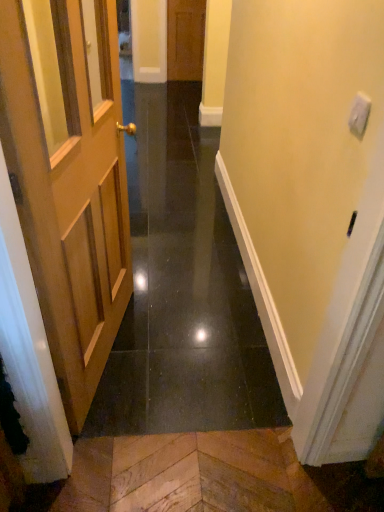
Question: Is wooden door at center, the second door positioned from the bottom, oriented away from light brown wooden door at left, the second door from the top?

Choices:
 (A) yes
 (B) no

Answer: (B)

Question: From the image's perspective, does wooden door at center, placed as the 1th door when sorted from back to front, appear lower than light brown wooden door at left, acting as the 1th door starting from the bottom?

Choices:
 (A) no
 (B) yes

Answer: (A)

Question: Is the depth of wooden door at center, the 2th door when ordered from front to back, greater than that of light brown wooden door at left, the second door from the top?

Choices:
 (A) yes
 (B) no

Answer: (A)

Question: Can you confirm if wooden door at center, which is the first door in top-to-bottom order, is positioned to the left of light brown wooden door at left, which ranks as the 2th door in back-to-front order?

Choices:
 (A) yes
 (B) no

Answer: (B)

Question: Does wooden door at center, the 2th door when ordered from front to back, have a larger size compared to light brown wooden door at left, the second door from the top?

Choices:
 (A) no
 (B) yes

Answer: (A)

Question: Would you say wooden door at left is inside or outside wooden door at center, the second door positioned from the bottom?

Choices:
 (A) outside
 (B) inside

Answer: (A)

Question: Considering the positions of wooden door at left and wooden door at center, the 2th door when ordered from front to back, in the image, is wooden door at left taller or shorter than wooden door at center, the 2th door when ordered from front to back,?

Choices:
 (A) tall
 (B) short

Answer: (B)

Question: Considering the relative positions of wooden door at left and wooden door at center, which is the first door in top-to-bottom order, in the image provided, is wooden door at left to the left or to the right of wooden door at center, which is the first door in top-to-bottom order,?

Choices:
 (A) left
 (B) right

Answer: (A)

Question: Is wooden door at left in front of or behind wooden door at center, placed as the 1th door when sorted from back to front, in the image?

Choices:
 (A) behind
 (B) front

Answer: (B)

Question: From a real-world perspective, is light brown wooden door at left, which ranks as the 2th door in back-to-front order, above or below wooden door at left?

Choices:
 (A) below
 (B) above

Answer: (B)

Question: Is light brown wooden door at left, the second door from the top, to the left or to the right of wooden door at left in the image?

Choices:
 (A) right
 (B) left

Answer: (B)

Question: Relative to wooden door at left, is light brown wooden door at left, acting as the 1th door starting from the bottom, in front or behind?

Choices:
 (A) behind
 (B) front

Answer: (B)

Question: Is light brown wooden door at left, acting as the 1th door starting from the bottom, situated inside wooden door at left or outside?

Choices:
 (A) inside
 (B) outside

Answer: (B)

Question: From a real-world perspective, relative to wooden door at left, is wooden door at center, which is the first door in top-to-bottom order, vertically above or below?

Choices:
 (A) above
 (B) below

Answer: (A)

Question: Is wooden door at center, placed as the 1th door when sorted from back to front, in front of or behind wooden door at left in the image?

Choices:
 (A) behind
 (B) front

Answer: (A)